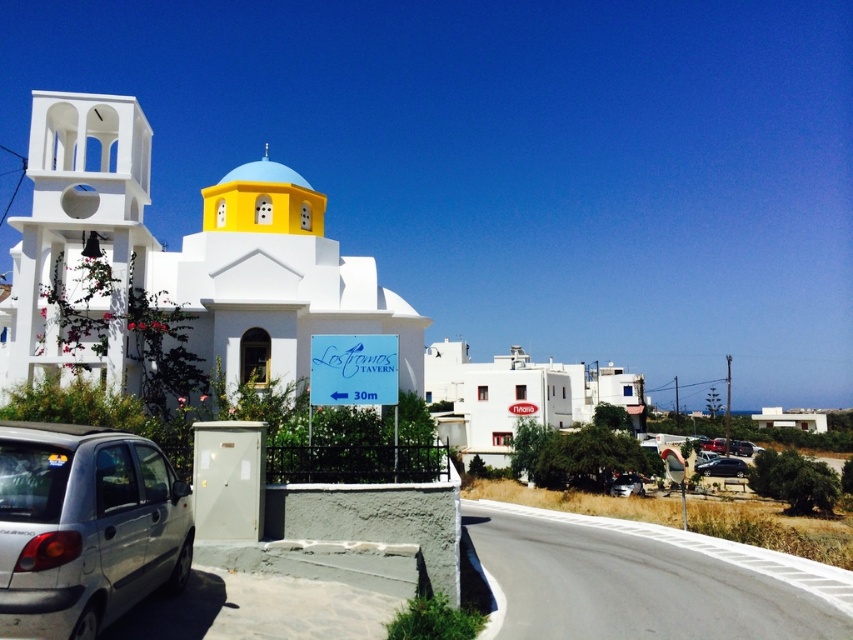
Question: Which object is positioned closest to the white matte church at left?

Choices:
 (A) metallic silver car at lower right
 (B) white matte bell tower at left
 (C) shiny black sedan at lower right

Answer: (B)

Question: Is white matte church at left positioned before metallic silver car at lower right?

Choices:
 (A) no
 (B) yes

Answer: (B)

Question: Which object is closer to the camera taking this photo?

Choices:
 (A) white matte church at left
 (B) silver metallic car at lower left

Answer: (B)

Question: Does white matte church at left have a larger size compared to white matte bell tower at left?

Choices:
 (A) no
 (B) yes

Answer: (B)

Question: Is white matte bell tower at left above metallic silver car at lower right?

Choices:
 (A) no
 (B) yes

Answer: (B)

Question: Which point is closer to the camera taking this photo?

Choices:
 (A) (730, 467)
 (B) (30, 212)

Answer: (B)